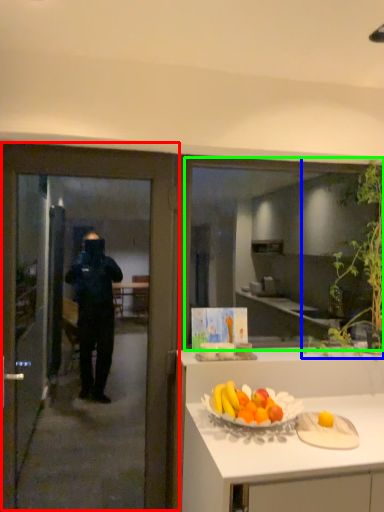
Question: Which is nearer to the door (highlighted by a red box)? plant (highlighted by a blue box) or window (highlighted by a green box).

Choices:
 (A) plant
 (B) window

Answer: (A)